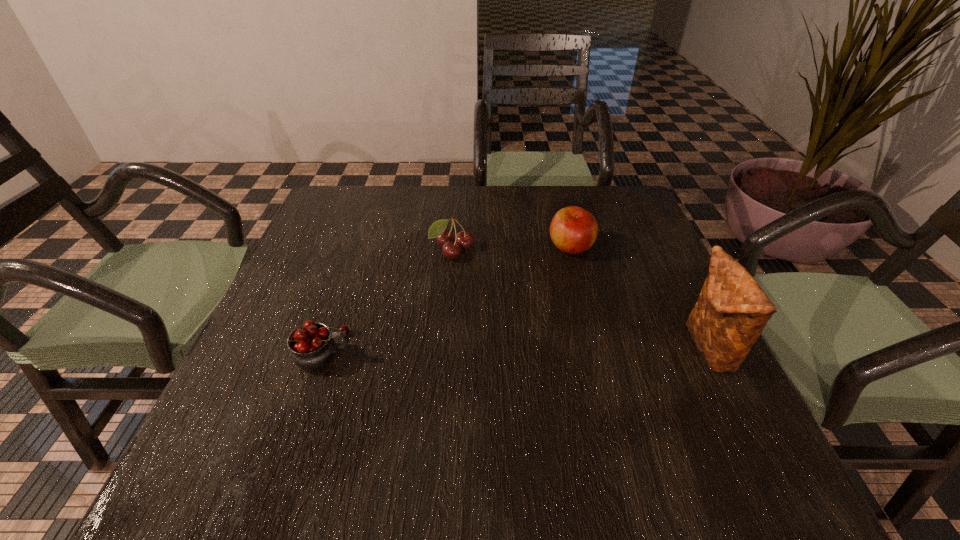
Locate an element on the screen. free space located on the open side of the rightmost object is located at coordinates (588, 348).

Locate an element on the screen. vacant space situated 0.320m on the leaves of the second object from left to right is located at coordinates (523, 356).

This screenshot has height=540, width=960. I want to click on vacant space located on the leaves of the second object from left to right, so [498, 319].

The height and width of the screenshot is (540, 960). Find the location of `free space located on the leaves of the second object from left to right`. free space located on the leaves of the second object from left to right is located at coordinates (523, 356).

Locate an element on the screen. The width and height of the screenshot is (960, 540). vacant space located 0.210m on the stem of the apple is located at coordinates (570, 325).

Identify the location of vacant area situated 0.350m on the stem of the apple. The height and width of the screenshot is (540, 960). (570, 380).

The image size is (960, 540). What are the coordinates of `free space located 0.370m on the stem of the apple` in the screenshot? It's located at (570, 389).

The image size is (960, 540). I want to click on object that is at the left edge, so click(x=312, y=346).

Image resolution: width=960 pixels, height=540 pixels. Identify the location of object present at the right edge. 732,310.

Where is `vacant space at the far edge of the desktop`? This screenshot has height=540, width=960. vacant space at the far edge of the desktop is located at coordinates (532, 211).